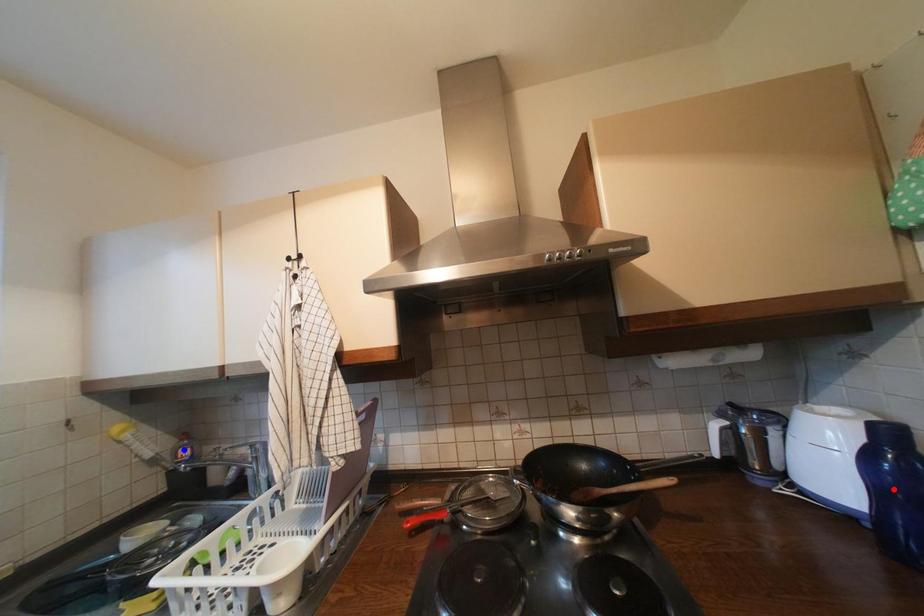
Question: Two points are marked on the image. Which point is closer to the camera?

Choices:
 (A) Blue point is closer.
 (B) Red point is closer.

Answer: (B)